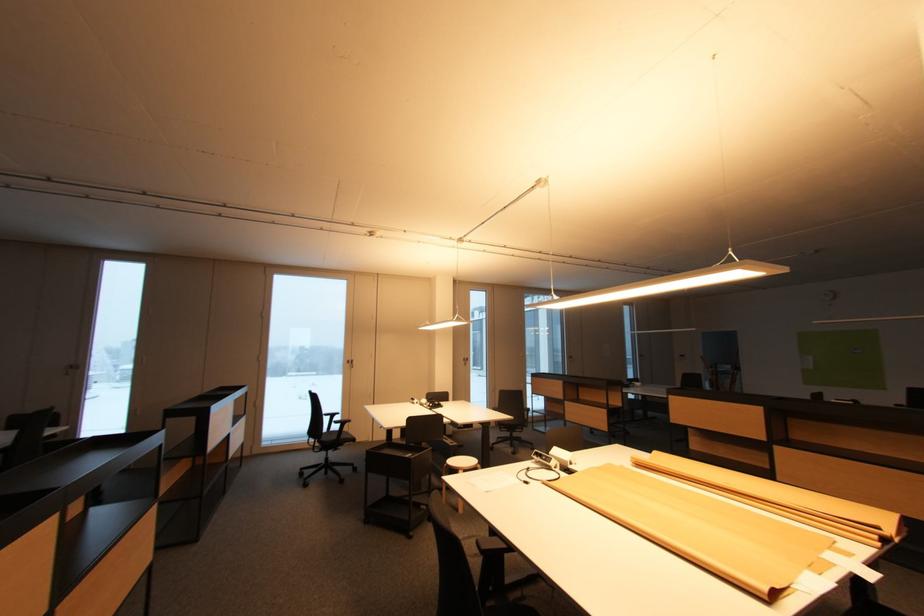
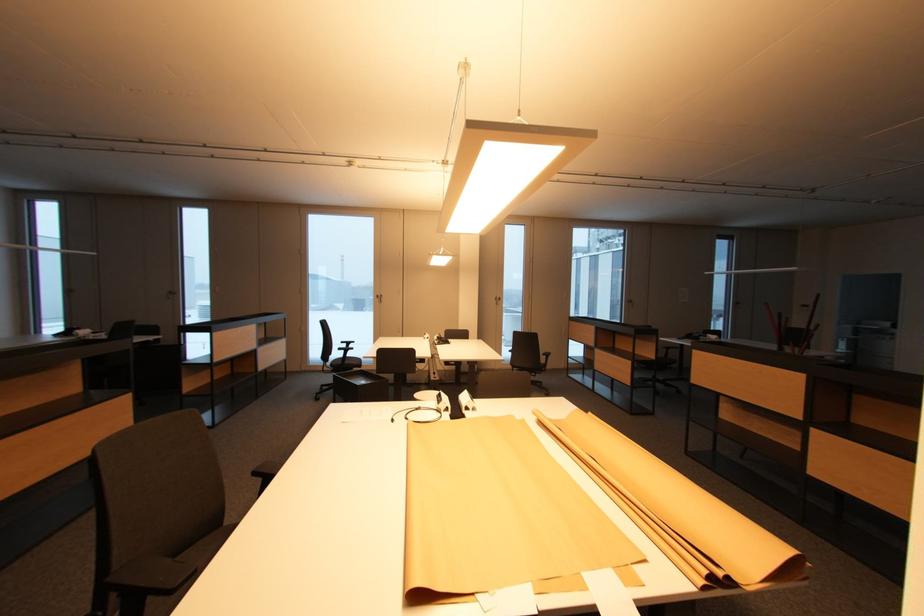
The images are taken continuously from a first-person perspective. In which direction are you moving?

The cameraman moved toward right, forward.